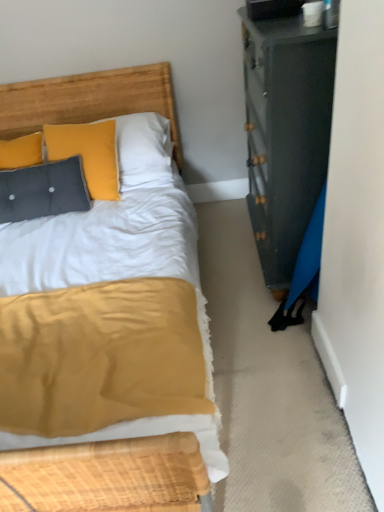
Question: In terms of width, does wooden headboard at upper left look wider or thinner when compared to textured gray pillow at upper left?

Choices:
 (A) thin
 (B) wide

Answer: (A)

Question: Considering the positions of point (145, 79) and point (41, 172), is point (145, 79) closer or farther from the camera than point (41, 172)?

Choices:
 (A) closer
 (B) farther

Answer: (B)

Question: Would you say wooden headboard at upper left is inside or outside textured gray pillow at upper left?

Choices:
 (A) inside
 (B) outside

Answer: (B)

Question: In terms of width, does textured gray pillow at upper left look wider or thinner when compared to wooden headboard at upper left?

Choices:
 (A) thin
 (B) wide

Answer: (B)

Question: Is point (81, 206) positioned closer to the camera than point (46, 89)?

Choices:
 (A) farther
 (B) closer

Answer: (B)

Question: From the image's perspective, is textured gray pillow at upper left above or below wooden headboard at upper left?

Choices:
 (A) below
 (B) above

Answer: (A)

Question: Do you think textured gray pillow at upper left is within wooden headboard at upper left, or outside of it?

Choices:
 (A) outside
 (B) inside

Answer: (A)